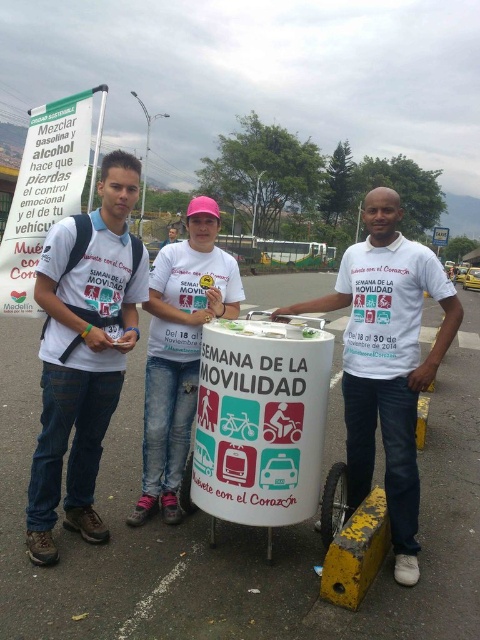
Question: Can you confirm if matte white t-shirt at center is smaller than white matte t-shirt at center?

Choices:
 (A) no
 (B) yes

Answer: (A)

Question: Can you confirm if matte white t-shirt at center is wider than white matte t-shirt at center?

Choices:
 (A) yes
 (B) no

Answer: (A)

Question: Which object is closer to the camera taking this photo?

Choices:
 (A) matte white t-shirt at center
 (B) white matte t-shirt at center

Answer: (A)

Question: Which point is closer to the camera?

Choices:
 (A) matte white t-shirt at center
 (B) white matte t-shirt at center

Answer: (A)

Question: Is matte white t-shirt at center thinner than white matte t-shirt at center?

Choices:
 (A) no
 (B) yes

Answer: (A)